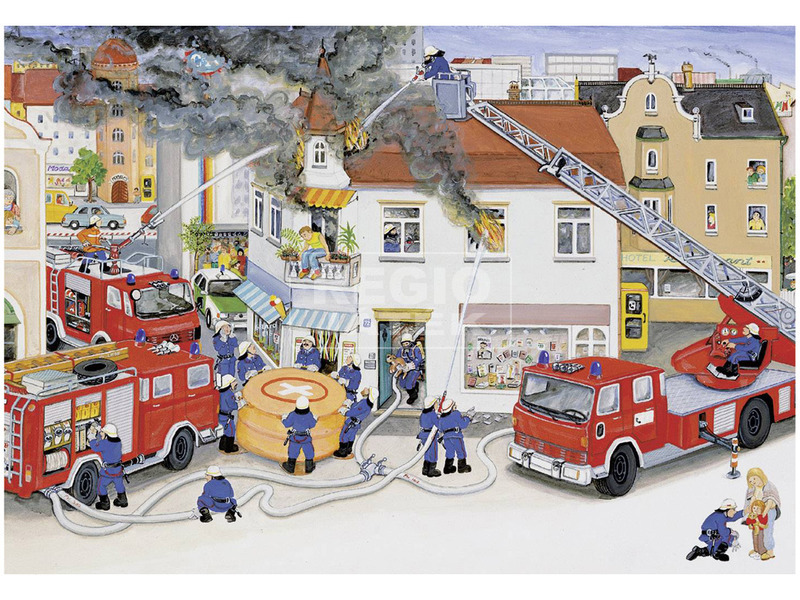
Find the location of `ladder`. ladder is located at coordinates (590, 182).